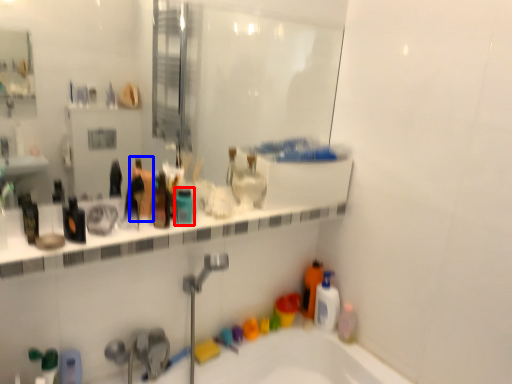
Question: Which object appears farthest to the camera in this image, mouthwash (highlighted by a red box) or toiletry (highlighted by a blue box)?

Choices:
 (A) mouthwash
 (B) toiletry

Answer: (A)